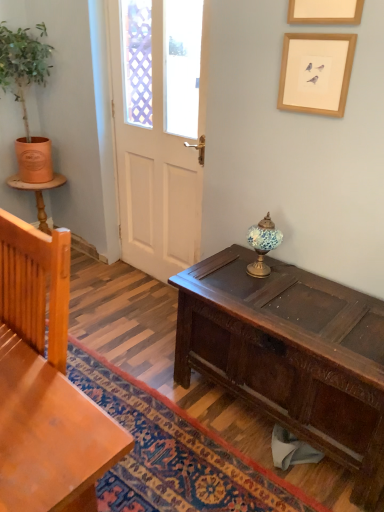
What do you see at coordinates (291, 354) in the screenshot? This screenshot has height=512, width=384. I see `dark brown wood desk at center` at bounding box center [291, 354].

Image resolution: width=384 pixels, height=512 pixels. What do you see at coordinates (316, 72) in the screenshot? I see `wooden picture frame at upper right, which appears as the first picture frame when ordered from the bottom` at bounding box center [316, 72].

Image resolution: width=384 pixels, height=512 pixels. What do you see at coordinates (325, 12) in the screenshot?
I see `white matte picture frame at upper center, the first picture frame positioned from the top` at bounding box center [325, 12].

What do you see at coordinates (45, 384) in the screenshot? I see `light brown wood chair at left` at bounding box center [45, 384].

What do you see at coordinates (153, 170) in the screenshot? The image size is (384, 512). I see `white matte door at center` at bounding box center [153, 170].

Identify the location of orange clay pot at left. The height and width of the screenshot is (512, 384). (23, 94).

Would you say orange clay pot at left is a long distance from dark brown wood desk at center?

Absolutely, orange clay pot at left is distant from dark brown wood desk at center.

Where is `houseplant above the dark brown wood desk at center (from a real-world perspective)`? Image resolution: width=384 pixels, height=512 pixels. houseplant above the dark brown wood desk at center (from a real-world perspective) is located at coordinates (23, 94).

Measure the distance from orange clay pot at left to dark brown wood desk at center.

orange clay pot at left and dark brown wood desk at center are 6.33 feet apart.

Considering the positions of objects orange clay pot at left and dark brown wood desk at center in the image provided, who is in front, orange clay pot at left or dark brown wood desk at center?

dark brown wood desk at center.

Consider the image. Considering the positions of objects white matte door at center and white matte picture frame at upper center, arranged as the 2th picture frame when ordered from the bottom, in the image provided, who is in front, white matte door at center or white matte picture frame at upper center, arranged as the 2th picture frame when ordered from the bottom,?

white matte picture frame at upper center, arranged as the 2th picture frame when ordered from the bottom, is in front.

From a real-world perspective, starting from the white matte door at center, which picture frame is the 2nd one vertically above it? Please provide its 2D coordinates.

[(325, 12)]

Measure the distance from white matte door at center to white matte picture frame at upper center, arranged as the 2th picture frame when ordered from the bottom.

A distance of 3.76 feet exists between white matte door at center and white matte picture frame at upper center, arranged as the 2th picture frame when ordered from the bottom.

What's the angular difference between light brown wood chair at left and orange clay pot at left's facing directions?

light brown wood chair at left and orange clay pot at left are facing 87.9 degrees away from each other.

Is light brown wood chair at left behind orange clay pot at left?

No, it is not.

Identify the location of houseplant above the light brown wood chair at left (from the image's perspective). This screenshot has height=512, width=384. (23, 94).

Is point (47, 389) closer to camera compared to point (39, 67)?

Yes, point (47, 389) is closer to viewer.

I want to click on chair below the white matte picture frame at upper center, arranged as the 2th picture frame when ordered from the bottom (from the image's perspective), so click(x=45, y=384).

From the image's perspective, which is above, white matte picture frame at upper center, the first picture frame positioned from the top, or light brown wood chair at left?

white matte picture frame at upper center, the first picture frame positioned from the top, from the image's perspective.

Is white matte picture frame at upper center, arranged as the 2th picture frame when ordered from the bottom, at the left side of light brown wood chair at left?

In fact, white matte picture frame at upper center, arranged as the 2th picture frame when ordered from the bottom, is to the right of light brown wood chair at left.

What's the angular difference between white matte picture frame at upper center, the first picture frame positioned from the top, and light brown wood chair at left's facing directions?

There is a 1.45-degree angle between the facing directions of white matte picture frame at upper center, the first picture frame positioned from the top, and light brown wood chair at left.

Is orange clay pot at left positioned beyond the bounds of white matte door at center?

Yes, orange clay pot at left is located beyond the bounds of white matte door at center.

Which is behind, point (22, 152) or point (198, 229)?

The point (22, 152) is behind.

Would you say orange clay pot at left is a long distance from white matte door at center?

They are positioned close to each other.

Locate an element on the screen. This screenshot has width=384, height=512. door below the orange clay pot at left (from the image's perspective) is located at coordinates (153, 170).

From the image's perspective, would you say light brown wood chair at left is positioned over wooden picture frame at upper right, which appears as the first picture frame when ordered from the bottom?

No, from the image's perspective, light brown wood chair at left is not above wooden picture frame at upper right, which appears as the first picture frame when ordered from the bottom.

From a real-world perspective, which object rests below the other?

light brown wood chair at left.

Who is smaller, light brown wood chair at left or wooden picture frame at upper right, the 2th picture frame from the top?

With smaller size is wooden picture frame at upper right, the 2th picture frame from the top.

Which is correct: light brown wood chair at left is inside wooden picture frame at upper right, the 2th picture frame from the top, or outside of it?

light brown wood chair at left lies outside wooden picture frame at upper right, the 2th picture frame from the top.

Can you confirm if light brown wood chair at left is thinner than white matte picture frame at upper center, arranged as the 2th picture frame when ordered from the bottom?

Incorrect, the width of light brown wood chair at left is not less than that of white matte picture frame at upper center, arranged as the 2th picture frame when ordered from the bottom.

How much distance is there between light brown wood chair at left and white matte picture frame at upper center, arranged as the 2th picture frame when ordered from the bottom?

light brown wood chair at left is 4.58 feet from white matte picture frame at upper center, arranged as the 2th picture frame when ordered from the bottom.

This screenshot has width=384, height=512. I want to click on the 1st picture frame behind the light brown wood chair at left, starting your count from the anchor, so click(x=325, y=12).

Consider the image. Is light brown wood chair at left oriented towards white matte picture frame at upper center, the first picture frame positioned from the top?

No, light brown wood chair at left is not turned towards white matte picture frame at upper center, the first picture frame positioned from the top.

Find the location of a particular element. The image size is (384, 512). desk in front of the orange clay pot at left is located at coordinates [291, 354].

From the image's perspective, starting from the white matte door at center, which picture frame is the 2nd one above? Please provide its 2D coordinates.

[(325, 12)]

Looking at this image, considering their positions, is white matte door at center positioned closer to wooden picture frame at upper right, the 2th picture frame from the top, than dark brown wood desk at center?

white matte door at center.

Which object lies further to the anchor point orange clay pot at left, white matte door at center or white matte picture frame at upper center, arranged as the 2th picture frame when ordered from the bottom?

white matte picture frame at upper center, arranged as the 2th picture frame when ordered from the bottom, is further to orange clay pot at left.

Which object lies nearer to the anchor point white matte picture frame at upper center, the first picture frame positioned from the top, white matte door at center or wooden picture frame at upper right, which appears as the first picture frame when ordered from the bottom?

The object closer to white matte picture frame at upper center, the first picture frame positioned from the top, is wooden picture frame at upper right, which appears as the first picture frame when ordered from the bottom.

Estimate the real-world distances between objects in this image. Which object is closer to dark brown wood desk at center, white matte picture frame at upper center, the first picture frame positioned from the top, or white matte door at center?

white matte door at center.

From the image, which object appears to be nearer to orange clay pot at left, white matte picture frame at upper center, arranged as the 2th picture frame when ordered from the bottom, or dark brown wood desk at center?

white matte picture frame at upper center, arranged as the 2th picture frame when ordered from the bottom, is closer to orange clay pot at left.

When comparing their distances from wooden picture frame at upper right, the 2th picture frame from the top, does orange clay pot at left or white matte door at center seem further?

orange clay pot at left is further to wooden picture frame at upper right, the 2th picture frame from the top.

Looking at this image, which object lies further to the anchor point white matte door at center, white matte picture frame at upper center, arranged as the 2th picture frame when ordered from the bottom, or light brown wood chair at left?

Among the two, light brown wood chair at left is located further to white matte door at center.

From the image, which object appears to be nearer to white matte door at center, light brown wood chair at left or orange clay pot at left?

Based on the image, orange clay pot at left appears to be nearer to white matte door at center.

I want to click on chair between orange clay pot at left and wooden picture frame at upper right, the 2th picture frame from the top, in the horizontal direction, so (x=45, y=384).

At what (x,y) coordinates should I click in order to perform the action: click on desk situated between orange clay pot at left and white matte picture frame at upper center, arranged as the 2th picture frame when ordered from the bottom, from left to right. Please return your answer as a coordinate pair (x, y). The height and width of the screenshot is (512, 384). Looking at the image, I should click on 291,354.

Find the location of a particular element. This screenshot has width=384, height=512. chair between white matte picture frame at upper center, the first picture frame positioned from the top, and dark brown wood desk at center in the up-down direction is located at coordinates (45, 384).

In order to click on door that lies between white matte picture frame at upper center, arranged as the 2th picture frame when ordered from the bottom, and light brown wood chair at left from top to bottom in this screenshot , I will do `click(153, 170)`.